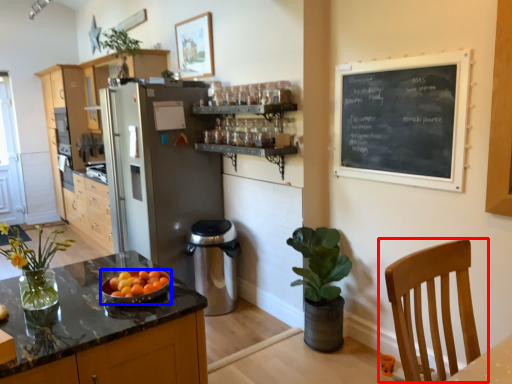
Question: Which of the following is the closest to the observer, chair (highlighted by a red box) or kitchen appliance (highlighted by a blue box)?

Choices:
 (A) chair
 (B) kitchen appliance

Answer: (A)